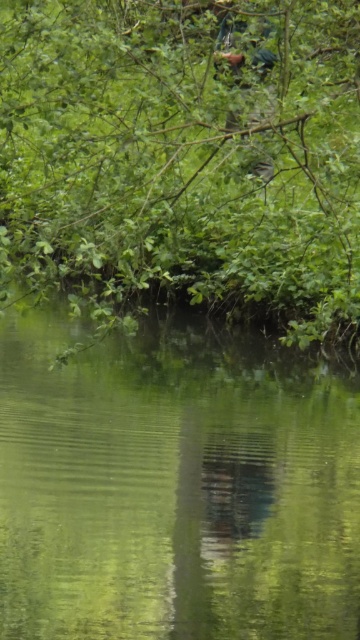
Does green leafy tree at upper center come behind brown leather jacket at upper center?

No, green leafy tree at upper center is in front of brown leather jacket at upper center.

Is point (195, 291) less distant than point (225, 54)?

No, it is not.

The height and width of the screenshot is (640, 360). Find the location of `green leafy tree at upper center`. green leafy tree at upper center is located at coordinates (189, 154).

Does green reflective water at center appear on the right side of brown leather jacket at upper center?

No, green reflective water at center is not to the right of brown leather jacket at upper center.

Does green reflective water at center appear on the left side of brown leather jacket at upper center?

Indeed, green reflective water at center is positioned on the left side of brown leather jacket at upper center.

This screenshot has height=640, width=360. I want to click on green reflective water at center, so click(173, 484).

Does green reflective water at center have a lesser height compared to green leafy tree at upper center?

Indeed, green reflective water at center has a lesser height compared to green leafy tree at upper center.

How much distance is there between green reflective water at center and green leafy tree at upper center?

green reflective water at center is 2.25 meters from green leafy tree at upper center.

Does point (286, 525) lie behind point (68, 77)?

Yes, point (286, 525) is behind point (68, 77).

This screenshot has height=640, width=360. Find the location of `green reflective water at center`. green reflective water at center is located at coordinates (173, 484).